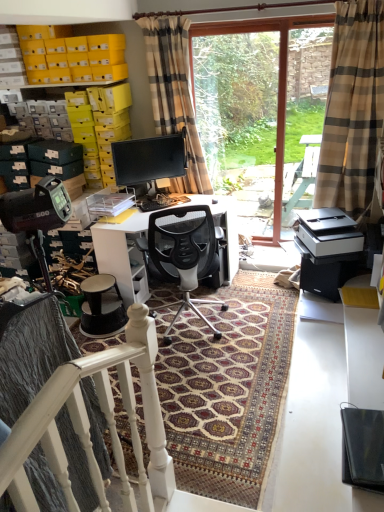
The height and width of the screenshot is (512, 384). What do you see at coordinates (123, 256) in the screenshot? I see `white glossy desk at center` at bounding box center [123, 256].

Image resolution: width=384 pixels, height=512 pixels. Describe the element at coordinates (278, 86) in the screenshot. I see `transparent glass door at center` at that location.

This screenshot has height=512, width=384. Find the location of `black mesh office chair at center`. black mesh office chair at center is located at coordinates (183, 253).

Identify the location of matte black monitor at center. (149, 159).

Measure the distance between plaid fabric curtain at center, the second curtain from the right, and camera.

plaid fabric curtain at center, the second curtain from the right, and camera are 3.29 meters apart from each other.

I want to click on white glossy desk at center, so click(123, 256).

Is transparent glass door at center facing towards beige plaid curtain at right, the 1th curtain from the right?

No, transparent glass door at center is not turned towards beige plaid curtain at right, the 1th curtain from the right.

In the scene shown: Is transparent glass door at center not within beige plaid curtain at right, which appears as the second curtain when viewed from the left?

Yes, transparent glass door at center is not within beige plaid curtain at right, which appears as the second curtain when viewed from the left.

Considering the relative positions of transparent glass door at center and beige plaid curtain at right, which appears as the second curtain when viewed from the left, in the image provided, is transparent glass door at center behind beige plaid curtain at right, which appears as the second curtain when viewed from the left,?

Yes, transparent glass door at center is further from the viewer.

Is point (168, 74) farther from camera compared to point (226, 278)?

That is False.

Is white glossy desk at center a part of plaid fabric curtain at center, the first curtain viewed from the left?

No, white glossy desk at center is located outside of plaid fabric curtain at center, the first curtain viewed from the left.

Locate an element on the screen. desk directly beneath the plaid fabric curtain at center, the first curtain viewed from the left (from a real-world perspective) is located at coordinates (123, 256).

Considering the sizes of objects plaid fabric curtain at center, the second curtain from the right, and white glossy desk at center in the image provided, who is bigger, plaid fabric curtain at center, the second curtain from the right, or white glossy desk at center?

With larger size is white glossy desk at center.

From the picture: Are matte black monitor at center and white glossy desk at center located far from each other?

No, matte black monitor at center is not far from white glossy desk at center.

Measure the distance from matte black monitor at center to white glossy desk at center.

A distance of 27.24 inches exists between matte black monitor at center and white glossy desk at center.

Is matte black monitor at center facing towards white glossy desk at center?

No, matte black monitor at center is not oriented towards white glossy desk at center.

Which of these two, matte black monitor at center or white glossy desk at center, stands taller?

With more height is white glossy desk at center.

From a real-world perspective, who is located higher, beige plaid curtain at right, which appears as the second curtain when viewed from the left, or plaid fabric curtain at center, the first curtain viewed from the left?

In real-world perspective, plaid fabric curtain at center, the first curtain viewed from the left, is above.

Is point (379, 69) closer or farther from the camera than point (195, 172)?

Point (379, 69) is closer to the camera than point (195, 172).

Does beige plaid curtain at right, the 1th curtain from the right, have a smaller size compared to plaid fabric curtain at center, the first curtain viewed from the left?

Incorrect, beige plaid curtain at right, the 1th curtain from the right, is not smaller in size than plaid fabric curtain at center, the first curtain viewed from the left.

Considering the relative sizes of matte black monitor at center and black plastic printer at lower right in the image provided, is matte black monitor at center taller than black plastic printer at lower right?

Yes, matte black monitor at center is taller than black plastic printer at lower right.

From a real-world perspective, is matte black monitor at center located higher than black plastic printer at lower right?

Yes, from a real-world perspective, matte black monitor at center is above black plastic printer at lower right.

Between matte black monitor at center and black plastic printer at lower right, which one has larger size?

black plastic printer at lower right.

Who is smaller, transparent glass door at center or black mesh office chair at center?

Smaller between the two is transparent glass door at center.

From the image's perspective, is transparent glass door at center located above black mesh office chair at center?

Yes, from the image's perspective, transparent glass door at center is above black mesh office chair at center.

Is transparent glass door at center next to black mesh office chair at center?

No, transparent glass door at center is not making contact with black mesh office chair at center.

Considering the positions of objects transparent glass door at center and black mesh office chair at center in the image provided, who is more to the left, transparent glass door at center or black mesh office chair at center?

From the viewer's perspective, black mesh office chair at center appears more on the left side.

Is beige plaid curtain at right, the 1th curtain from the right, surrounding white glossy desk at center?

No, white glossy desk at center is located outside of beige plaid curtain at right, the 1th curtain from the right.

Who is shorter, beige plaid curtain at right, which appears as the second curtain when viewed from the left, or white glossy desk at center?

white glossy desk at center is shorter.

The height and width of the screenshot is (512, 384). I want to click on desk that appears below the beige plaid curtain at right, which appears as the second curtain when viewed from the left (from a real-world perspective), so click(123, 256).

Which is in front, point (333, 115) or point (101, 264)?

The point (333, 115) is closer.

Find the location of `curtain that appears below the transparent glass door at center (from the image's perspective)`. curtain that appears below the transparent glass door at center (from the image's perspective) is located at coordinates (352, 108).

The width and height of the screenshot is (384, 512). What are the coordinates of `desk below the plaid fabric curtain at center, the second curtain from the right (from a real-world perspective)` in the screenshot? It's located at [x=123, y=256].

Looking at the image, which one is located further to black mesh office chair at center, matte black monitor at center or transparent glass door at center?

transparent glass door at center.

Estimate the real-world distances between objects in this image. Which object is closer to matte black monitor at center, black plastic printer at lower right or transparent glass door at center?

transparent glass door at center is closer to matte black monitor at center.

Looking at the image, which one is located closer to black mesh office chair at center, plaid fabric curtain at center, the second curtain from the right, or matte black monitor at center?

matte black monitor at center lies closer to black mesh office chair at center than the other object.

Based on their spatial positions, is plaid fabric curtain at center, the first curtain viewed from the left, or black mesh office chair at center further from black plastic printer at lower right?

plaid fabric curtain at center, the first curtain viewed from the left, lies further to black plastic printer at lower right than the other object.

Estimate the real-world distances between objects in this image. Which object is closer to white glossy desk at center, beige plaid curtain at right, which appears as the second curtain when viewed from the left, or matte black monitor at center?

matte black monitor at center.

Estimate the real-world distances between objects in this image. Which object is closer to black mesh office chair at center, matte black monitor at center or white glossy desk at center?

white glossy desk at center is positioned closer to the anchor black mesh office chair at center.

Looking at the image, which one is located closer to black textured stool at lower left, black mesh office chair at center or matte black monitor at center?

black mesh office chair at center.

Considering their positions, is plaid fabric curtain at center, the first curtain viewed from the left, positioned closer to black plastic printer at lower right than black textured stool at lower left?

plaid fabric curtain at center, the first curtain viewed from the left, lies closer to black plastic printer at lower right than the other object.

You are a GUI agent. You are given a task and a screenshot of the screen. Output one action in this format:
    pyautogui.click(x=<x>, y=<y>)
    Task: Click on the printer that lies between plaid fabric curtain at center, the second curtain from the right, and white glossy desk at center from top to bottom
    
    Given the screenshot: What is the action you would take?
    pyautogui.click(x=329, y=232)

This screenshot has width=384, height=512. I want to click on bay window between matte black monitor at center and beige plaid curtain at right, which appears as the second curtain when viewed from the left, so click(278, 86).

This screenshot has width=384, height=512. I want to click on curtain between matte black monitor at center and black plastic printer at lower right from left to right, so click(174, 93).

Where is `chair that lies between plaid fabric curtain at center, the second curtain from the right, and black textured stool at lower left from top to bottom`? The width and height of the screenshot is (384, 512). chair that lies between plaid fabric curtain at center, the second curtain from the right, and black textured stool at lower left from top to bottom is located at coordinates (183, 253).